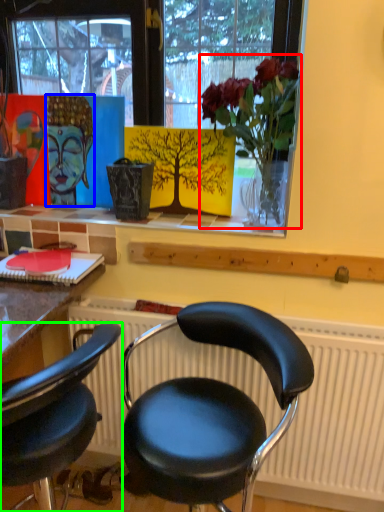
Question: Which object is the closest to the floral arrangement (highlighted by a red box)? Choose among these: art (highlighted by a blue box) or chair (highlighted by a green box).

Choices:
 (A) art
 (B) chair

Answer: (A)